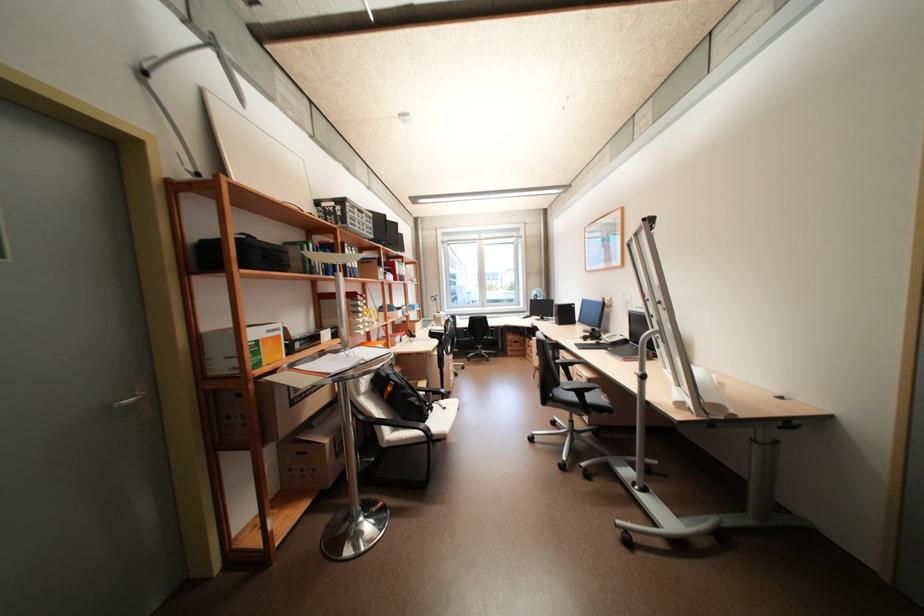
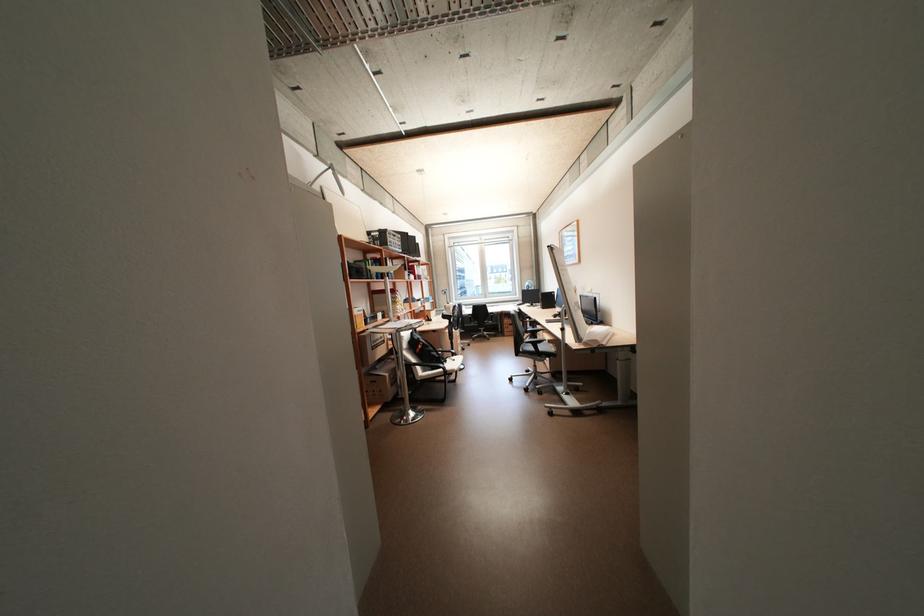
Question: Which direction would the cameraman need to move to produce the second image? Reply with the corresponding letter.

Choices:
 (A) Left
 (B) Right
 (C) Forward
 (D) Backward

Answer: (D)